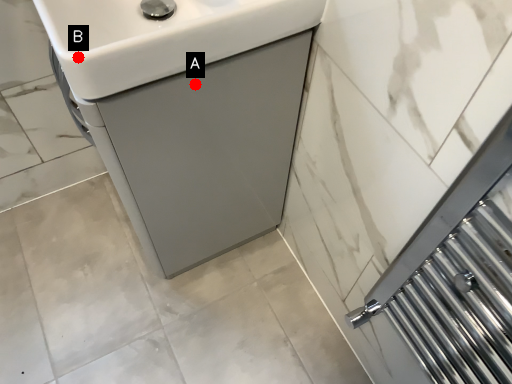
Question: Two points are circled on the image, labeled by A and B beside each circle. Which point is closer to the camera?

Choices:
 (A) A is closer
 (B) B is closer

Answer: (B)